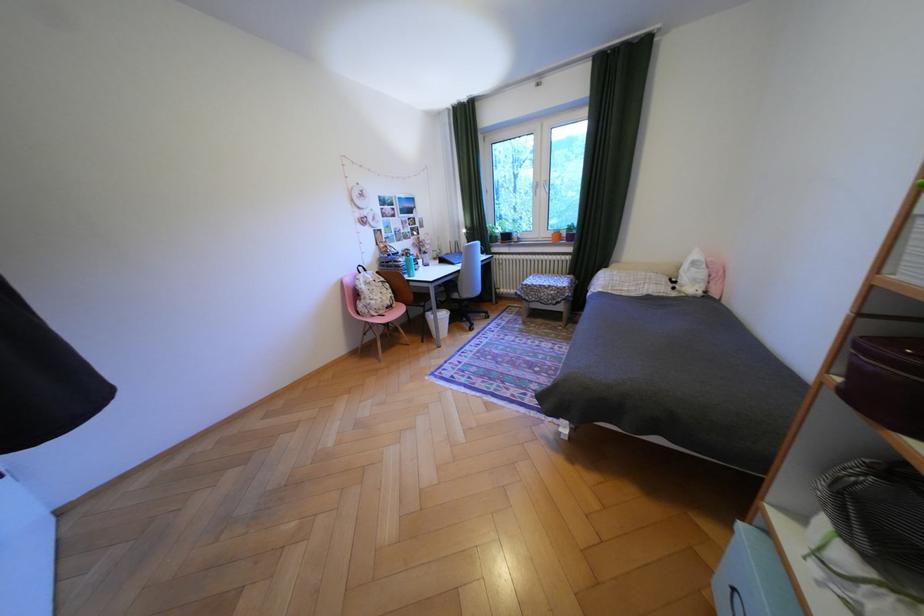
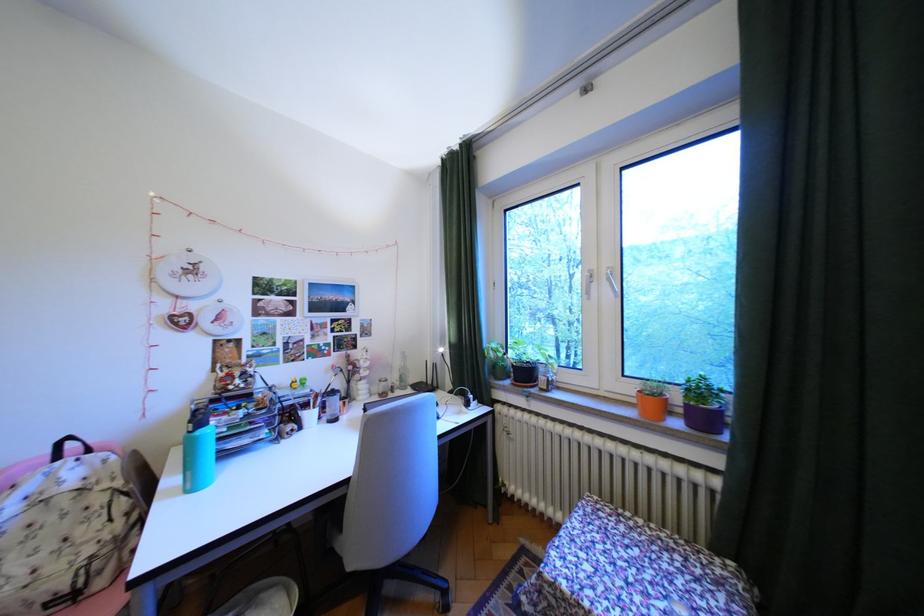
The point at (581, 228) is marked in the first image. Where is the corresponding point in the second image?

(710, 391)